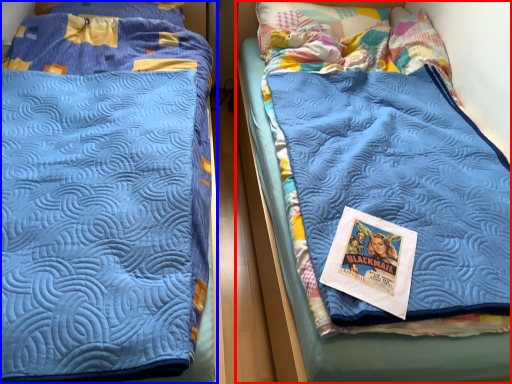
Question: Which of the following is the closest to the observer, bed (highlighted by a red box) or bed (highlighted by a blue box)?

Choices:
 (A) bed
 (B) bed

Answer: (B)